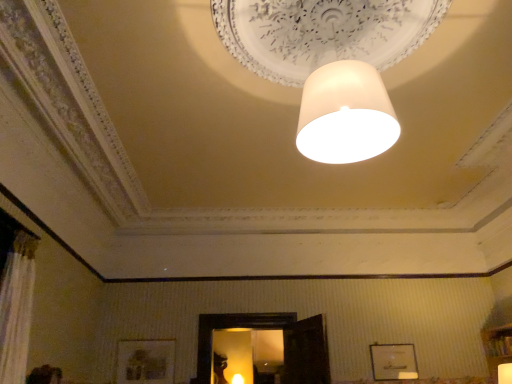
Image resolution: width=512 pixels, height=384 pixels. Identify the location of wooden picture frame at lower center, the 1th picture frame positioned from the left. (145, 362).

How much space does matte white lampshade at upper center, the 3th lamp in the top-to-bottom sequence, occupy horizontally?

It is 6.98 inches.

The width and height of the screenshot is (512, 384). What do you see at coordinates (504, 373) in the screenshot?
I see `matte white lampshade at upper center, which is the 2th lamp from front to back` at bounding box center [504, 373].

What are the coordinates of `wooden picture frame at lower center, the 1th picture frame positioned from the left` in the screenshot? It's located at (145, 362).

Is white matte picture frame at lower right, the 1th picture frame viewed from the right, to the left or to the right of white matte lampshade at center, arranged as the second lamp when viewed from the right, in the image?

In the image, white matte picture frame at lower right, the 1th picture frame viewed from the right, appears on the right side of white matte lampshade at center, arranged as the second lamp when viewed from the right.

Is white matte picture frame at lower right, which ranks as the second picture frame in left-to-right order, spatially inside white matte lampshade at center, arranged as the third lamp when ordered from the bottom, or outside of it?

white matte picture frame at lower right, which ranks as the second picture frame in left-to-right order, is not enclosed by white matte lampshade at center, arranged as the third lamp when ordered from the bottom.

From a real-world perspective, is white matte picture frame at lower right, the 1th picture frame viewed from the right, physically located above or below white matte lampshade at center, the 1th lamp when ordered from top to bottom?

white matte picture frame at lower right, the 1th picture frame viewed from the right, is below white matte lampshade at center, the 1th lamp when ordered from top to bottom.

Are white matte picture frame at lower right, which ranks as the second picture frame in left-to-right order, and white matte lampshade at center, arranged as the third lamp when ordered from the bottom, beside each other?

No, white matte picture frame at lower right, which ranks as the second picture frame in left-to-right order, is not making contact with white matte lampshade at center, arranged as the third lamp when ordered from the bottom.

Based on the photo, is matte white lampshade at upper center, which ranks as the first lamp in left-to-right order, smaller than white matte picture frame at lower right, the 1th picture frame viewed from the right?

Indeed, matte white lampshade at upper center, which ranks as the first lamp in left-to-right order, has a smaller size compared to white matte picture frame at lower right, the 1th picture frame viewed from the right.

In terms of height, does matte white lampshade at upper center, marked as the 1th lamp in a bottom-to-top arrangement, look taller or shorter compared to white matte picture frame at lower right, which ranks as the second picture frame in left-to-right order?

In the image, matte white lampshade at upper center, marked as the 1th lamp in a bottom-to-top arrangement, appears to be shorter than white matte picture frame at lower right, which ranks as the second picture frame in left-to-right order.

Does matte white lampshade at upper center, the 3th lamp in the top-to-bottom sequence, have a lesser width compared to white matte picture frame at lower right, the 1th picture frame viewed from the right?

In fact, matte white lampshade at upper center, the 3th lamp in the top-to-bottom sequence, might be wider than white matte picture frame at lower right, the 1th picture frame viewed from the right.

Is matte white lampshade at upper center, marked as the 1th lamp in a bottom-to-top arrangement, not close to white matte picture frame at lower right, the 1th picture frame viewed from the right?

Yes, matte white lampshade at upper center, marked as the 1th lamp in a bottom-to-top arrangement, is far from white matte picture frame at lower right, the 1th picture frame viewed from the right.

From a real-world perspective, who is located higher, white matte picture frame at lower right, the 1th picture frame viewed from the right, or wooden picture frame at lower center, the 1th picture frame positioned from the left?

In real-world perspective, wooden picture frame at lower center, the 1th picture frame positioned from the left, is above.

Can you tell me how much white matte picture frame at lower right, which ranks as the second picture frame in left-to-right order, and wooden picture frame at lower center, the 1th picture frame positioned from the left, differ in facing direction?

There is a 0.122-degree angle between the facing directions of white matte picture frame at lower right, which ranks as the second picture frame in left-to-right order, and wooden picture frame at lower center, the 1th picture frame positioned from the left.

Is white matte picture frame at lower right, which ranks as the second picture frame in left-to-right order, beside wooden picture frame at lower center, placed as the second picture frame when sorted from right to left?

No, white matte picture frame at lower right, which ranks as the second picture frame in left-to-right order, is not beside wooden picture frame at lower center, placed as the second picture frame when sorted from right to left.

Is white matte picture frame at lower right, the 1th picture frame viewed from the right, looking in the opposite direction of wooden picture frame at lower center, placed as the second picture frame when sorted from right to left?

No, white matte picture frame at lower right, the 1th picture frame viewed from the right, is not facing away from wooden picture frame at lower center, placed as the second picture frame when sorted from right to left.

Can you tell me how much wooden picture frame at lower center, the 1th picture frame positioned from the left, and matte white lampshade at upper center, the 3th lamp in the top-to-bottom sequence, differ in facing direction?

The angle between the facing direction of wooden picture frame at lower center, the 1th picture frame positioned from the left, and the facing direction of matte white lampshade at upper center, the 3th lamp in the top-to-bottom sequence, is 0.751 degrees.

Is wooden picture frame at lower center, the 1th picture frame positioned from the left, positioned far away from matte white lampshade at upper center, arranged as the third lamp when viewed from the front?

Yes.

Is wooden picture frame at lower center, placed as the second picture frame when sorted from right to left, facing away from matte white lampshade at upper center, which is the third lamp from right to left?

Yes, matte white lampshade at upper center, which is the third lamp from right to left, is at the back of wooden picture frame at lower center, placed as the second picture frame when sorted from right to left.

Which is in front, wooden picture frame at lower center, placed as the second picture frame when sorted from right to left, or matte white lampshade at upper center, which ranks as the first lamp in back-to-front order?

wooden picture frame at lower center, placed as the second picture frame when sorted from right to left, is more forward.

Considering the relative sizes of matte white lampshade at upper center, the 3th lamp in the top-to-bottom sequence, and matte white lampshade at upper center, which is the 2th lamp from front to back, in the image provided, is matte white lampshade at upper center, the 3th lamp in the top-to-bottom sequence, bigger than matte white lampshade at upper center, which is the 2th lamp from front to back,?

Yes, matte white lampshade at upper center, the 3th lamp in the top-to-bottom sequence, is bigger than matte white lampshade at upper center, which is the 2th lamp from front to back.

Would you say matte white lampshade at upper center, marked as the 1th lamp in a bottom-to-top arrangement, is to the left or to the right of matte white lampshade at upper center, which ranks as the third lamp in left-to-right order, in the picture?

matte white lampshade at upper center, marked as the 1th lamp in a bottom-to-top arrangement, is positioned on matte white lampshade at upper center, which ranks as the third lamp in left-to-right order,'s left side.

From a real-world perspective, is matte white lampshade at upper center, which ranks as the first lamp in left-to-right order, physically located above or below matte white lampshade at upper center, arranged as the second lamp when ordered from the bottom?

Clearly, from a real-world perspective, matte white lampshade at upper center, which ranks as the first lamp in left-to-right order, is above matte white lampshade at upper center, arranged as the second lamp when ordered from the bottom.

Where is `the 2nd picture frame below the white matte lampshade at center, the 1th lamp when ordered from front to back (from a real-world perspective)`? the 2nd picture frame below the white matte lampshade at center, the 1th lamp when ordered from front to back (from a real-world perspective) is located at coordinates (393, 362).

Consider the image. Is the position of white matte lampshade at center, which is counted as the third lamp, starting from the back, more distant than that of white matte picture frame at lower right, which ranks as the second picture frame in left-to-right order?

No, the depth of white matte lampshade at center, which is counted as the third lamp, starting from the back, is less than that of white matte picture frame at lower right, which ranks as the second picture frame in left-to-right order.

Which of these two, white matte lampshade at center, arranged as the second lamp when viewed from the right, or white matte picture frame at lower right, the 1th picture frame viewed from the right, stands shorter?

With less height is white matte picture frame at lower right, the 1th picture frame viewed from the right.

Can you confirm if white matte lampshade at center, arranged as the third lamp when ordered from the bottom, is positioned to the left of white matte picture frame at lower right, the 1th picture frame viewed from the right?

Indeed, white matte lampshade at center, arranged as the third lamp when ordered from the bottom, is positioned on the left side of white matte picture frame at lower right, the 1th picture frame viewed from the right.

From the image's perspective, does matte white lampshade at upper center, arranged as the second lamp when ordered from the bottom, appear higher than matte white lampshade at upper center, which ranks as the first lamp in left-to-right order?

Indeed, from the image's perspective, matte white lampshade at upper center, arranged as the second lamp when ordered from the bottom, is shown above matte white lampshade at upper center, which ranks as the first lamp in left-to-right order.

Which is closer, (507,378) or (237,379)?

Point (507,378)

Looking at their sizes, would you say matte white lampshade at upper center, which is counted as the second lamp, starting from the top, is wider or thinner than matte white lampshade at upper center, marked as the 1th lamp in a bottom-to-top arrangement?

Clearly, matte white lampshade at upper center, which is counted as the second lamp, starting from the top, has less width compared to matte white lampshade at upper center, marked as the 1th lamp in a bottom-to-top arrangement.

From a real-world perspective, does matte white lampshade at upper center, which is the first lamp from right to left, stand above matte white lampshade at upper center, which is the third lamp from right to left?

No.

The width and height of the screenshot is (512, 384). Identify the location of lamp located above the white matte picture frame at lower right, the 1th picture frame viewed from the right (from the image's perspective). (330, 63).

From the image's perspective, starting from the white matte picture frame at lower right, which ranks as the second picture frame in left-to-right order, which lamp is the 2nd one below? Please provide its 2D coordinates.

[(237, 379)]

From the image, which object appears to be nearer to matte white lampshade at upper center, which is the third lamp from right to left, white matte picture frame at lower right, which ranks as the second picture frame in left-to-right order, or matte white lampshade at upper center, which is counted as the second lamp, starting from the top?

white matte picture frame at lower right, which ranks as the second picture frame in left-to-right order, lies closer to matte white lampshade at upper center, which is the third lamp from right to left, than the other object.

Which object lies nearer to the anchor point white matte picture frame at lower right, the 1th picture frame viewed from the right, matte white lampshade at upper center, which ranks as the first lamp in back-to-front order, or matte white lampshade at upper center, which ranks as the third lamp in left-to-right order?

Based on the image, matte white lampshade at upper center, which ranks as the third lamp in left-to-right order, appears to be nearer to white matte picture frame at lower right, the 1th picture frame viewed from the right.

Estimate the real-world distances between objects in this image. Which object is further from wooden picture frame at lower center, the 1th picture frame positioned from the left, white matte picture frame at lower right, which ranks as the second picture frame in left-to-right order, or matte white lampshade at upper center, the 3th lamp in the top-to-bottom sequence?

white matte picture frame at lower right, which ranks as the second picture frame in left-to-right order, is positioned further to the anchor wooden picture frame at lower center, the 1th picture frame positioned from the left.

Looking at the image, which one is located further to wooden picture frame at lower center, placed as the second picture frame when sorted from right to left, matte white lampshade at upper center, placed as the second lamp when sorted from back to front, or white matte lampshade at center, which is counted as the third lamp, starting from the back?

The object further to wooden picture frame at lower center, placed as the second picture frame when sorted from right to left, is white matte lampshade at center, which is counted as the third lamp, starting from the back.

From the image, which object appears to be nearer to matte white lampshade at upper center, marked as the 1th lamp in a bottom-to-top arrangement, wooden picture frame at lower center, the 1th picture frame positioned from the left, or matte white lampshade at upper center, which is the 2th lamp from front to back?

wooden picture frame at lower center, the 1th picture frame positioned from the left, is positioned closer to the anchor matte white lampshade at upper center, marked as the 1th lamp in a bottom-to-top arrangement.

From the image, which object appears to be farther from matte white lampshade at upper center, placed as the second lamp when sorted from back to front, matte white lampshade at upper center, which ranks as the first lamp in back-to-front order, or wooden picture frame at lower center, placed as the second picture frame when sorted from right to left?

wooden picture frame at lower center, placed as the second picture frame when sorted from right to left, is further to matte white lampshade at upper center, placed as the second lamp when sorted from back to front.

Looking at the image, which one is located further to wooden picture frame at lower center, placed as the second picture frame when sorted from right to left, white matte picture frame at lower right, the 1th picture frame viewed from the right, or white matte lampshade at center, which is counted as the second lamp, starting from the left?

white matte lampshade at center, which is counted as the second lamp, starting from the left, is positioned further to the anchor wooden picture frame at lower center, placed as the second picture frame when sorted from right to left.

From the image, which object appears to be farther from white matte picture frame at lower right, the 1th picture frame viewed from the right, matte white lampshade at upper center, arranged as the third lamp when viewed from the front, or wooden picture frame at lower center, placed as the second picture frame when sorted from right to left?

wooden picture frame at lower center, placed as the second picture frame when sorted from right to left, lies further to white matte picture frame at lower right, the 1th picture frame viewed from the right, than the other object.

The image size is (512, 384). Identify the location of picture frame between white matte lampshade at center, which is counted as the second lamp, starting from the left, and white matte picture frame at lower right, the 1th picture frame viewed from the right, along the z-axis. (145, 362).

Find the location of a particular element. The width and height of the screenshot is (512, 384). picture frame situated between wooden picture frame at lower center, the 1th picture frame positioned from the left, and matte white lampshade at upper center, which is the first lamp from right to left, from left to right is located at coordinates (393, 362).

Locate an element on the screen. The height and width of the screenshot is (384, 512). lamp located between white matte lampshade at center, the 1th lamp when ordered from top to bottom, and matte white lampshade at upper center, arranged as the third lamp when viewed from the front, in the depth direction is located at coordinates (504, 373).

Identify the location of lamp located between white matte lampshade at center, the 1th lamp when ordered from top to bottom, and white matte picture frame at lower right, the 1th picture frame viewed from the right, in the depth direction. This screenshot has height=384, width=512. (504, 373).